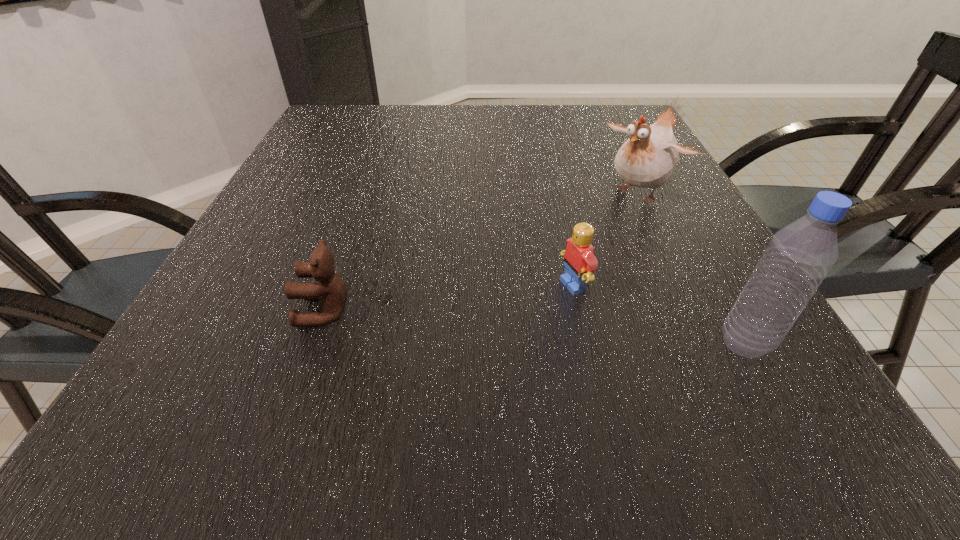
Locate an element on the screen. The height and width of the screenshot is (540, 960). free space on the desktop that is between the leftmost object and the tallest object and is positioned at the beak of the bird is located at coordinates (479, 322).

Where is `vacant spot on the desktop that is between the teddy bear and the tallest object and is positioned on the front-facing side of the second object from left to right`? The width and height of the screenshot is (960, 540). vacant spot on the desktop that is between the teddy bear and the tallest object and is positioned on the front-facing side of the second object from left to right is located at coordinates (466, 322).